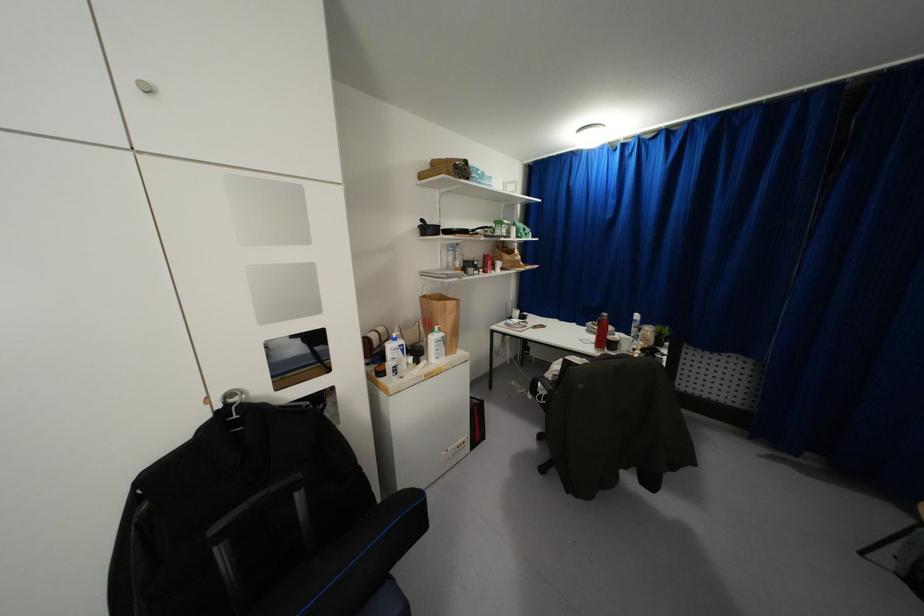
The width and height of the screenshot is (924, 616). I want to click on white pump bottle, so click(x=395, y=355).